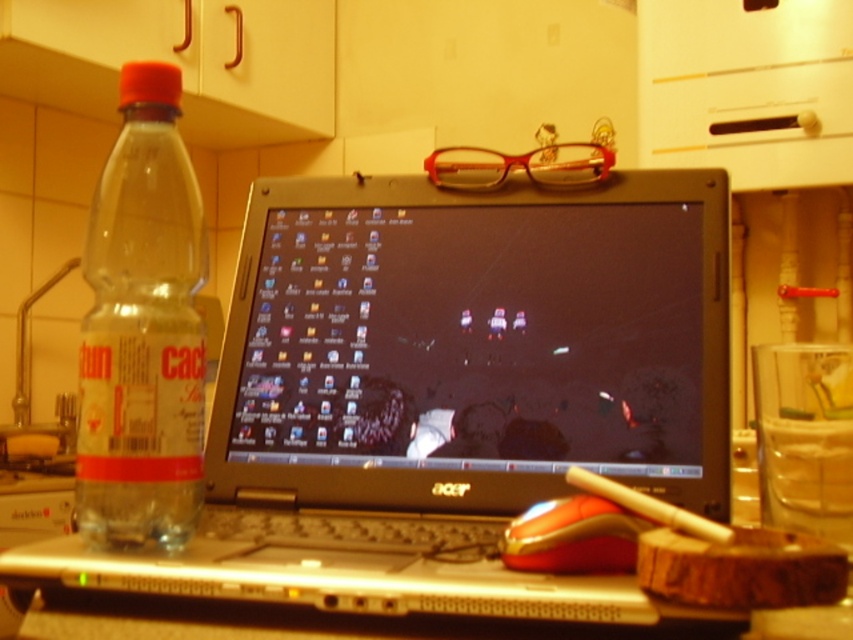
Question: Which point is closer to the camera?

Choices:
 (A) metallic silver laptop at center
 (B) clear plastic bottle at left
 (C) translucent orange plastic glasses at upper center

Answer: (A)

Question: Which object appears farthest from the camera in this image?

Choices:
 (A) translucent orange plastic glasses at upper center
 (B) clear plastic bottle at left
 (C) orange matte mouse at lower center

Answer: (A)

Question: Can you confirm if clear plastic bottle at left is positioned to the left of translucent orange plastic glasses at upper center?

Choices:
 (A) yes
 (B) no

Answer: (A)

Question: Does orange matte mouse at lower center have a larger size compared to translucent orange plastic glasses at upper center?

Choices:
 (A) yes
 (B) no

Answer: (B)

Question: Estimate the real-world distances between objects in this image. Which object is closer to the metallic silver laptop at center?

Choices:
 (A) translucent orange plastic glasses at upper center
 (B) orange matte mouse at lower center
 (C) clear plastic bottle at left

Answer: (B)

Question: Does metallic silver laptop at center have a smaller size compared to orange matte mouse at lower center?

Choices:
 (A) yes
 (B) no

Answer: (B)